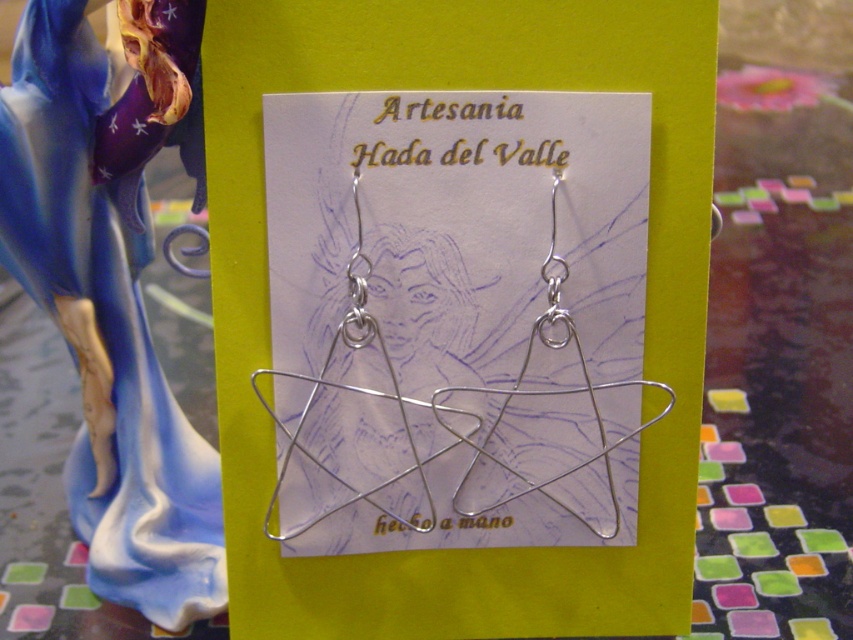
Question: Can you confirm if matte porcelain figure at left is thinner than silver wire star at center?

Choices:
 (A) no
 (B) yes

Answer: (B)

Question: Is matte porcelain figure at left closer to camera compared to silver wire star at center?

Choices:
 (A) yes
 (B) no

Answer: (A)

Question: Among these points, which one is farthest from the camera?

Choices:
 (A) (129, 480)
 (B) (614, 499)

Answer: (A)

Question: Can you confirm if matte porcelain figure at left is positioned to the right of silver wire star at center?

Choices:
 (A) yes
 (B) no

Answer: (B)

Question: Which of the following is the closest to the observer?

Choices:
 (A) (544, 323)
 (B) (194, 442)

Answer: (A)

Question: Which of the following is the farthest from the observer?

Choices:
 (A) (84, 220)
 (B) (610, 474)

Answer: (A)